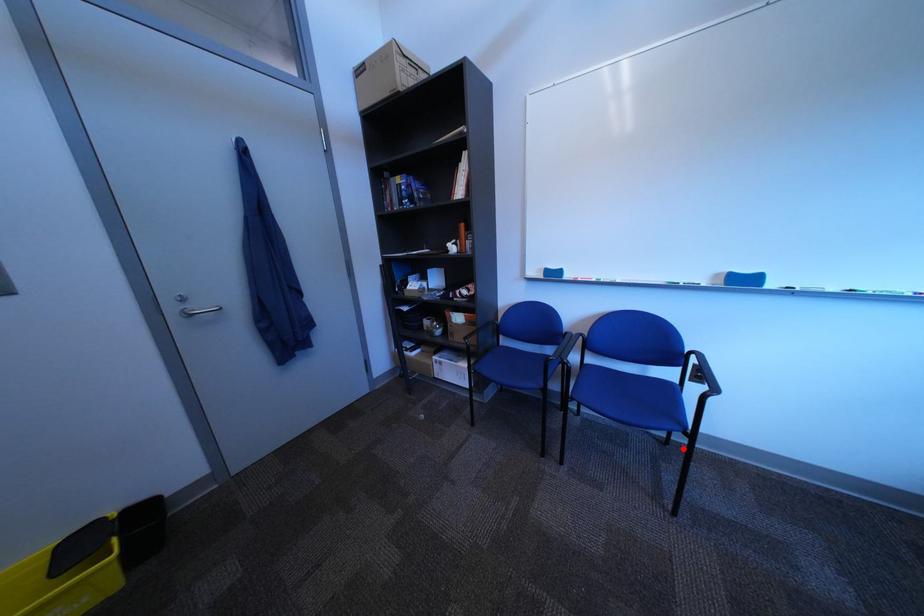
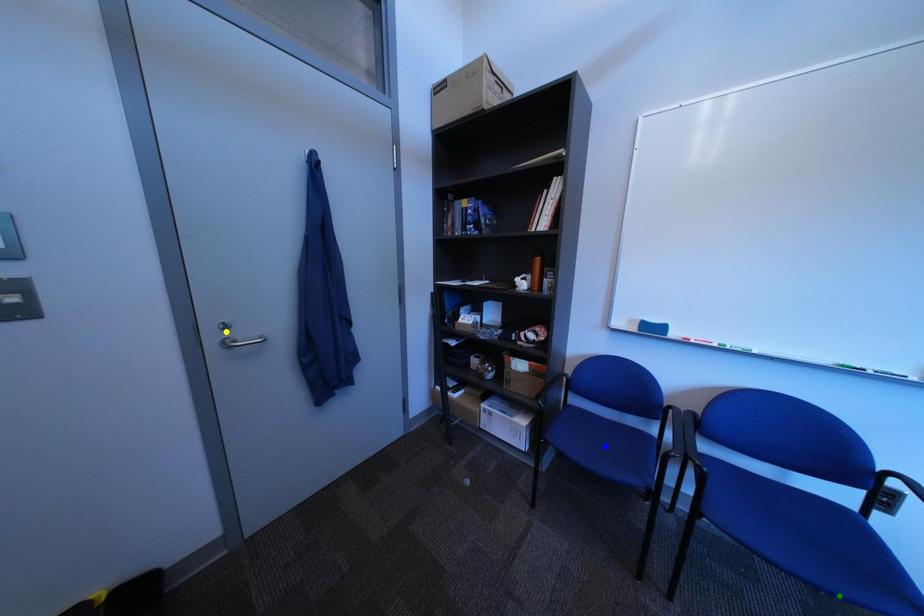
Question: I am providing you with two images of the same scene from different viewpoints. A red point is marked on the first image. You are given multiple points on the second image. Which point in image 2 is actually the same real-world point as the red point in image 1?

Choices:
 (A) blue point
 (B) yellow point
 (C) green point

Answer: (C)